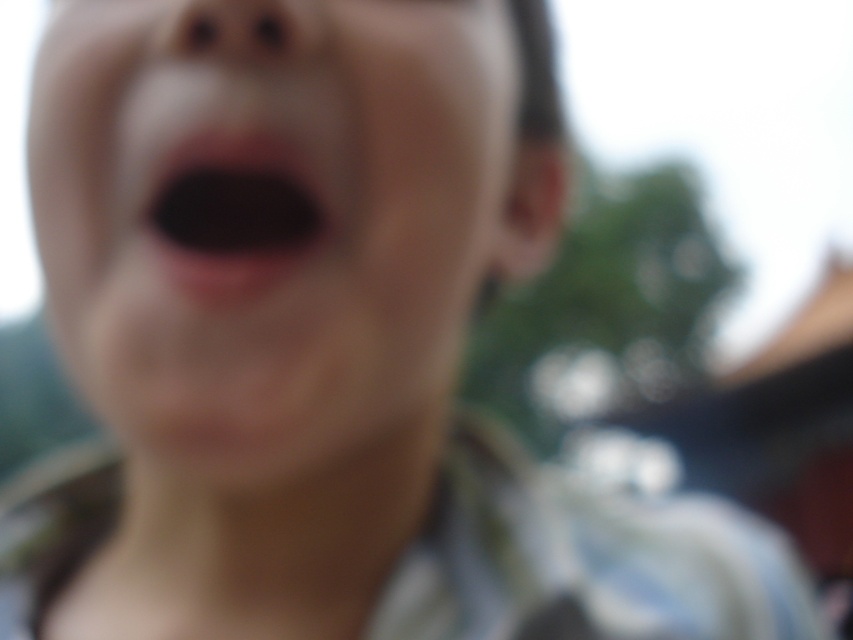
Based on the scene description, which object is positioned higher on the face between the smooth skin face at center and the black matte mouth at center?

The smooth skin face at center is positioned higher than the black matte mouth at center.

You are a photographer trying to capture a closeup of the smooth skin face at center and the black matte mouth at center. Based on the scene description, which object appears wider in the image?

The smooth skin face at center appears wider than the black matte mouth at center according to the description.